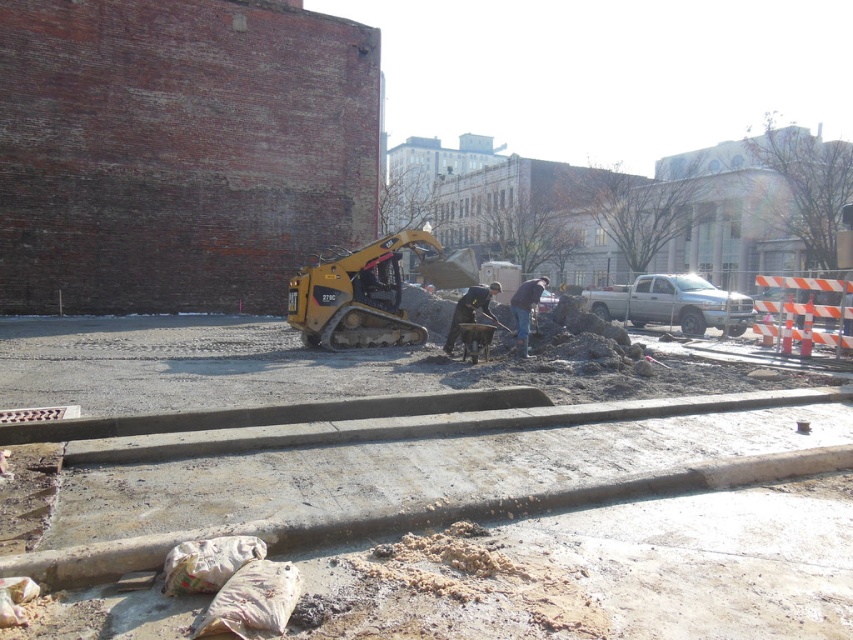
Question: Which point appears closest to the camera in this image?

Choices:
 (A) (474, 289)
 (B) (531, 298)

Answer: (B)

Question: Among these points, which one is nearest to the camera?

Choices:
 (A) (445, 337)
 (B) (376, 292)
 (C) (521, 316)
 (D) (103, 561)

Answer: (D)

Question: Is dark gray uniform at center to the right of dark blue jeans at center from the viewer's perspective?

Choices:
 (A) no
 (B) yes

Answer: (A)

Question: Can you confirm if matte concrete sidewalk at center is positioned to the right of dark blue jeans at center?

Choices:
 (A) no
 (B) yes

Answer: (A)

Question: Is black rubber excavator at center wider than dark blue jeans at center?

Choices:
 (A) yes
 (B) no

Answer: (B)

Question: Among these points, which one is farthest from the camera?

Choices:
 (A) (479, 291)
 (B) (312, 307)
 (C) (509, 305)

Answer: (C)